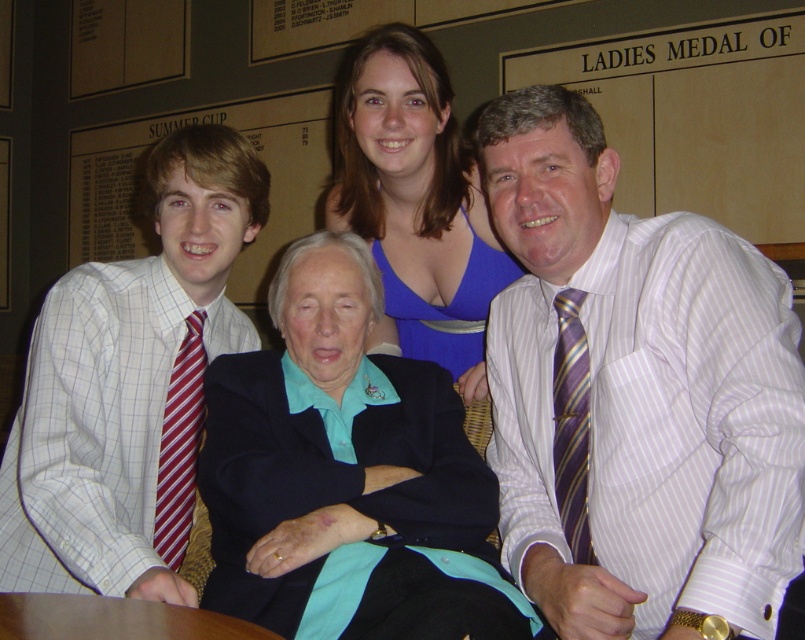
Based on the photo, does white checkered shirt at left appear over red striped tie at left?

Correct, white checkered shirt at left is located above red striped tie at left.

What do you see at coordinates (130, 387) in the screenshot? Image resolution: width=805 pixels, height=640 pixels. I see `white checkered shirt at left` at bounding box center [130, 387].

The width and height of the screenshot is (805, 640). What are the coordinates of `white checkered shirt at left` in the screenshot? It's located at (130, 387).

How distant is brown wooden table at lower left from red striped tie at left?

They are 23.71 inches apart.

What do you see at coordinates (114, 620) in the screenshot? Image resolution: width=805 pixels, height=640 pixels. I see `brown wooden table at lower left` at bounding box center [114, 620].

The image size is (805, 640). Find the location of `brown wooden table at lower left`. brown wooden table at lower left is located at coordinates (114, 620).

In order to click on brown wooden table at lower left in this screenshot , I will do `click(114, 620)`.

Can you confirm if striped silk tie at right is positioned above red striped tie at left?

Yes, striped silk tie at right is above red striped tie at left.

Between point (556, 433) and point (197, 316), which one is positioned behind?

Positioned behind is point (197, 316).

Locate an element on the screen. striped silk tie at right is located at coordinates (572, 424).